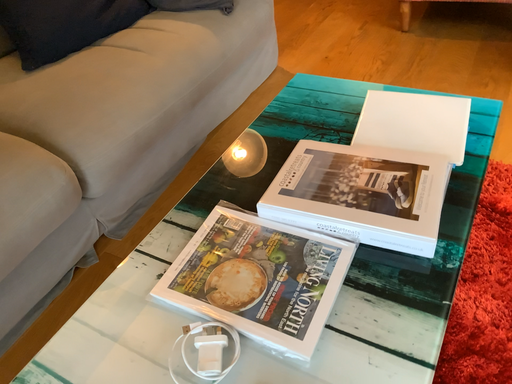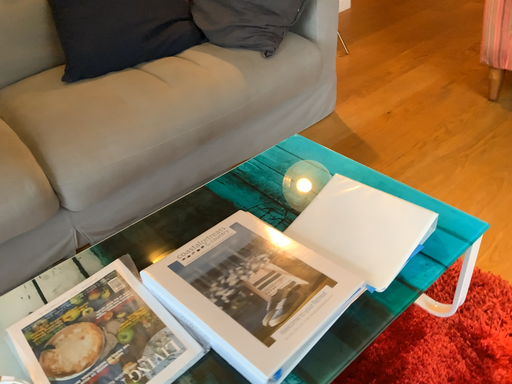
Question: How did the camera likely rotate when shooting the video?

Choices:
 (A) rotated right
 (B) rotated left

Answer: (B)